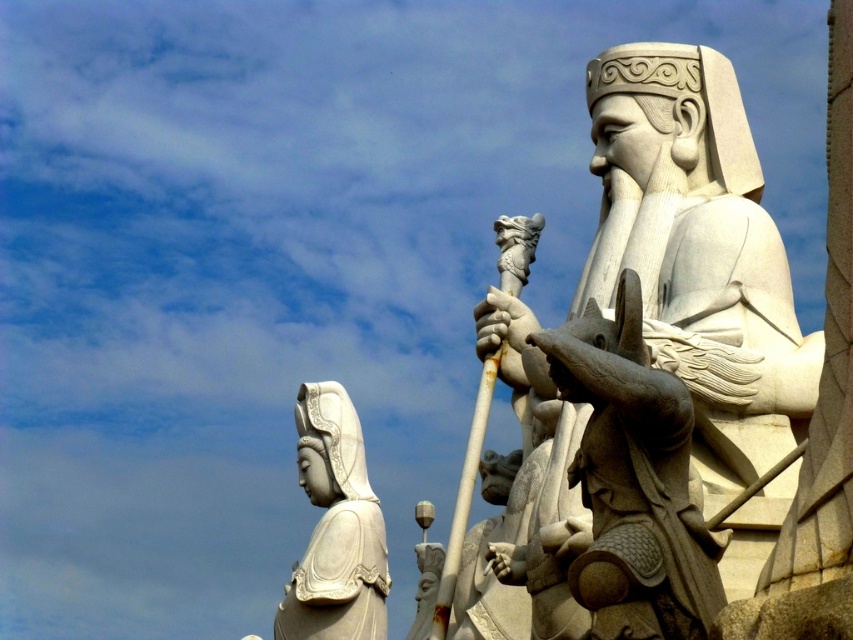
Looking at this image, can you confirm if white stone statue at right is shorter than white stone statue at lower left?

No.

Which is behind, point (672, 218) or point (363, 509)?

The point (363, 509) is behind.

I want to click on white stone statue at right, so click(x=697, y=256).